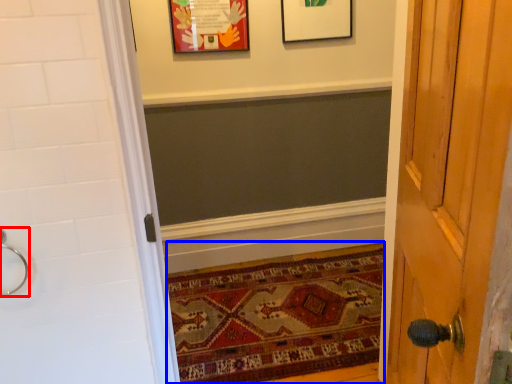
Question: Among these objects, which one is nearest to the camera, door handle (highlighted by a red box) or mat (highlighted by a blue box)?

Choices:
 (A) door handle
 (B) mat

Answer: (A)